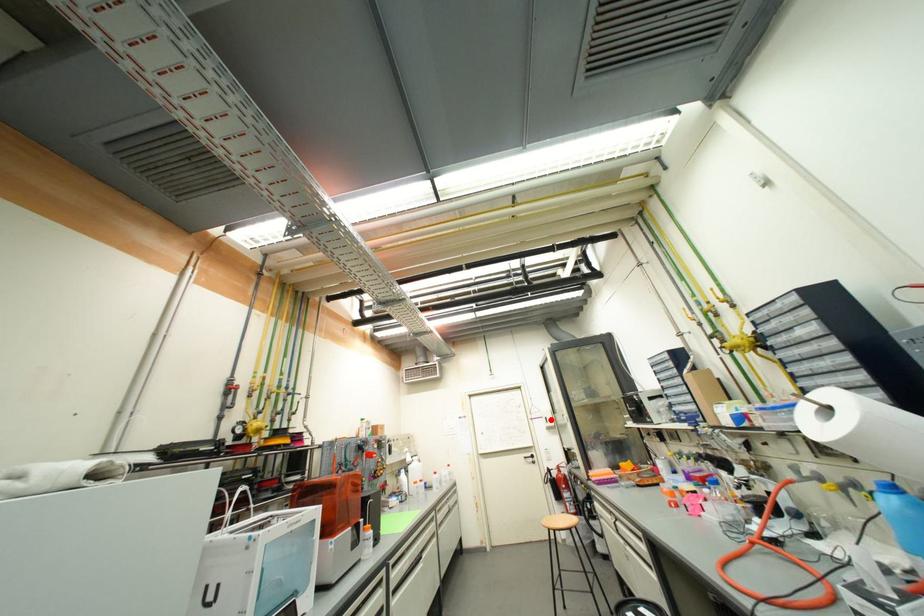
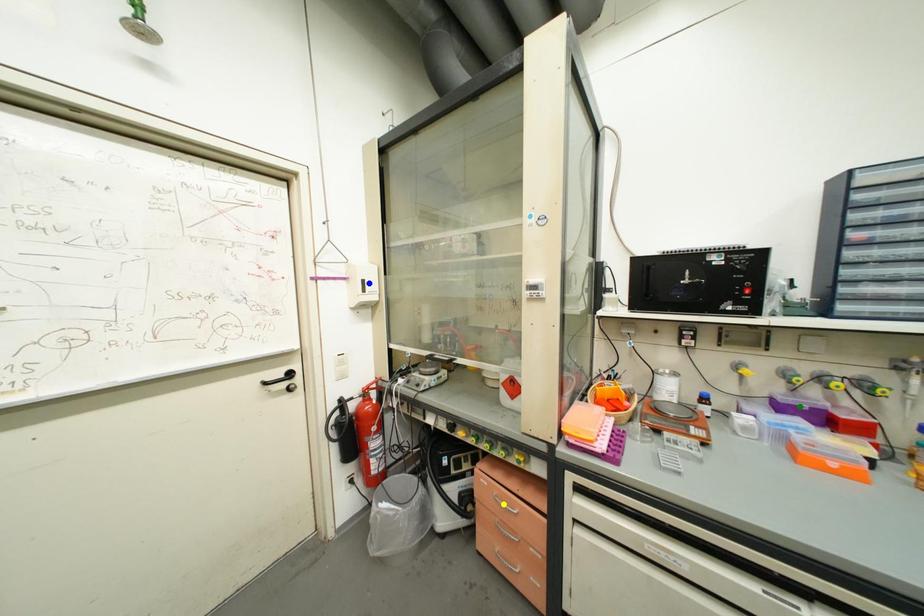
Question: I am providing you with two images of the same scene from different viewpoints. A red point is marked on the first image. You are given multiple points on the second image. Which spot in image 2 lines up with the point in image 1?

Choices:
 (A) green point
 (B) yellow point
 (C) blue point

Answer: (C)